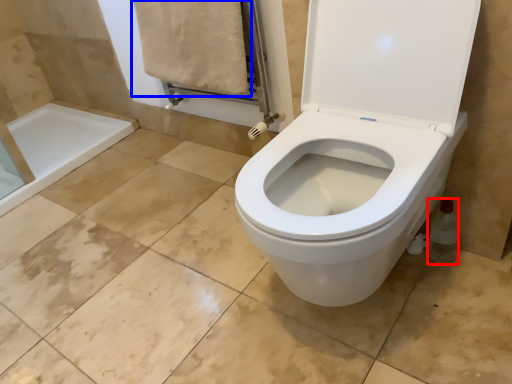
Question: Which object is closer to the camera taking this photo, bottle (highlighted by a red box) or bath towel (highlighted by a blue box)?

Choices:
 (A) bottle
 (B) bath towel

Answer: (A)